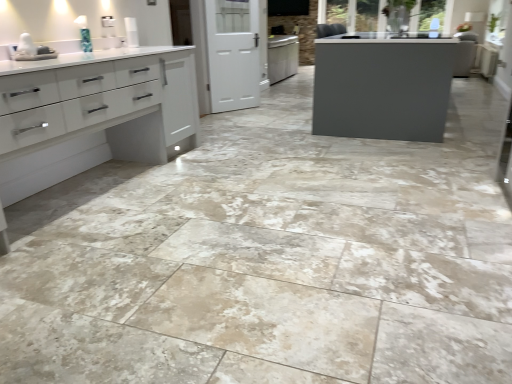
Identify the location of vacant space to the right of white glossy cabinet at left. (271, 185).